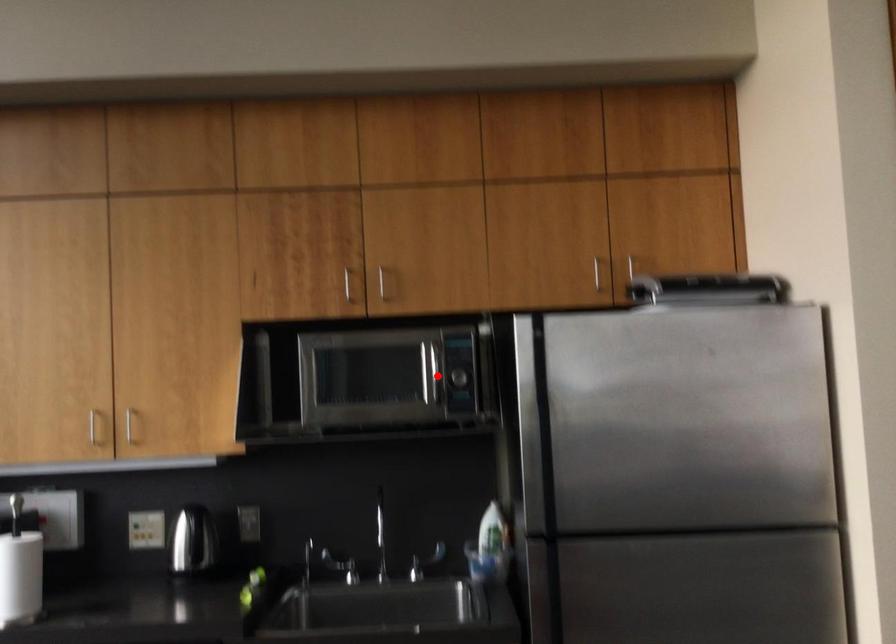
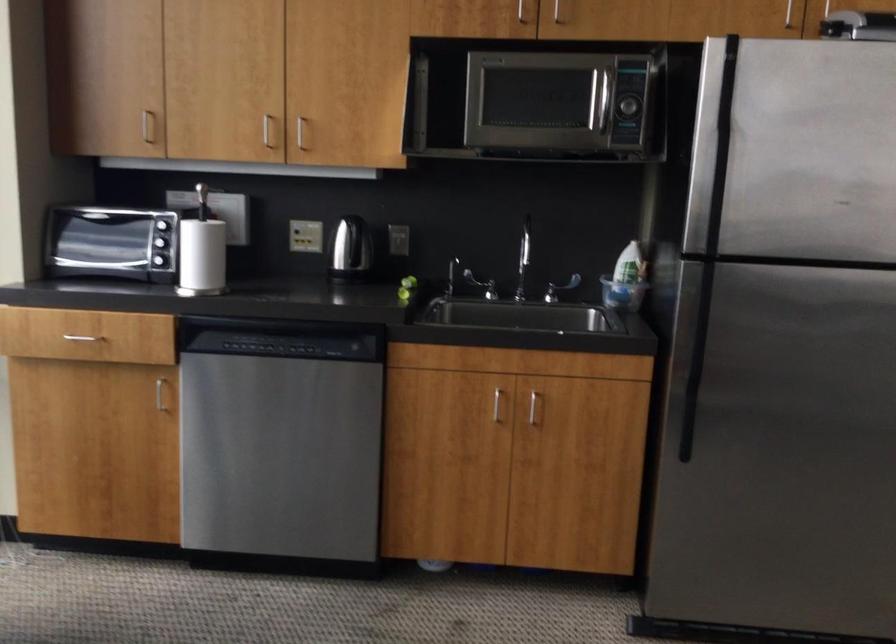
Find the pixel in the second image that matches the highlighted location in the first image.

(602, 106)